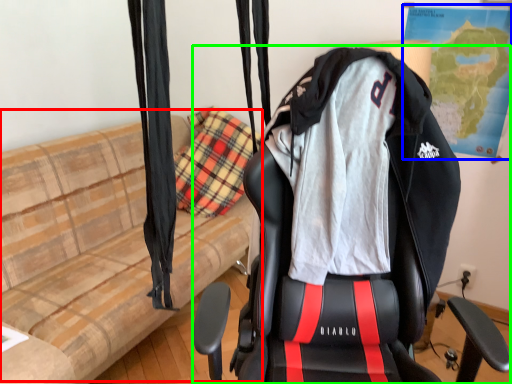
Question: Which object is positioned farthest from couch (highlighted by a red box)? Select from map (highlighted by a blue box) and chair (highlighted by a green box).

Choices:
 (A) map
 (B) chair

Answer: (A)